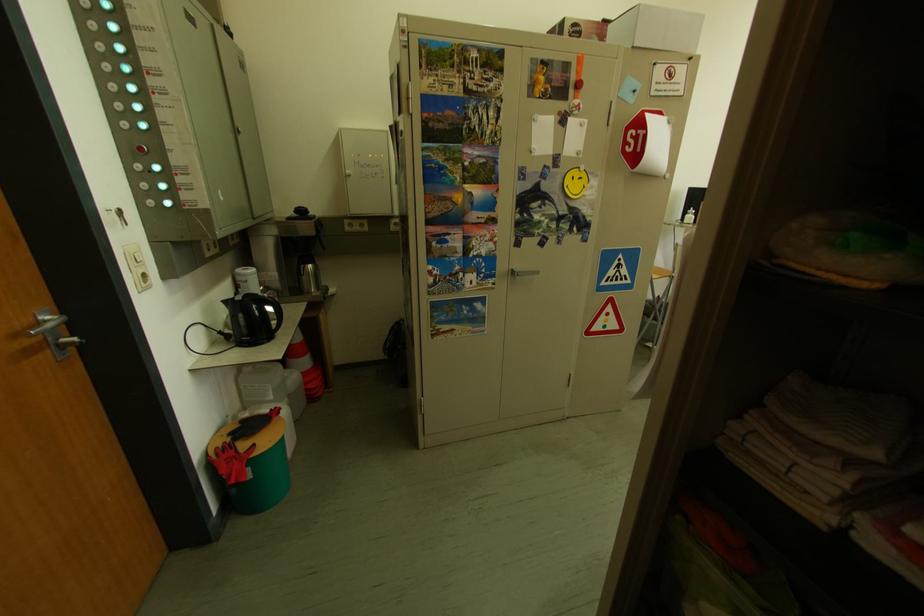
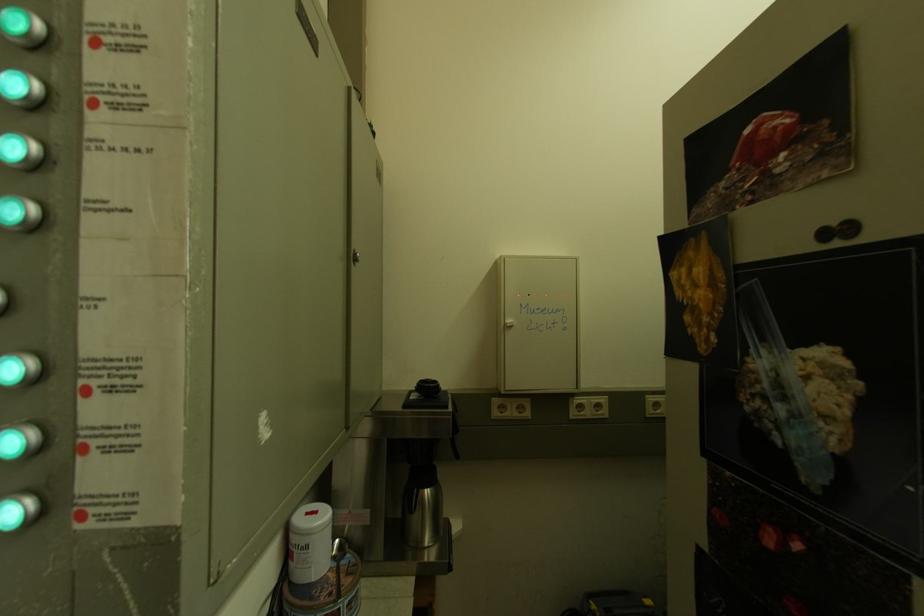
The point at [301,222] is marked in the first image. Where is the corresponding point in the second image?

(420, 408)